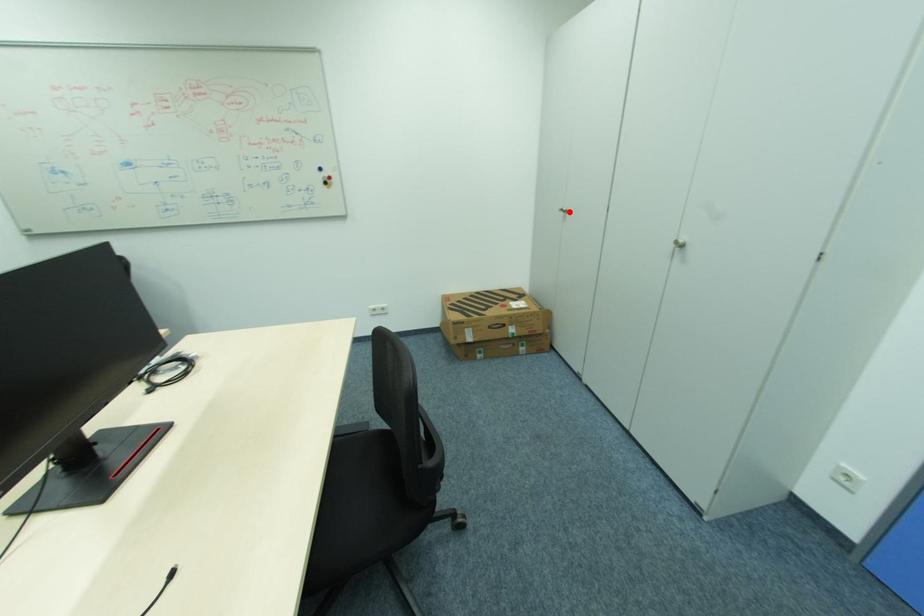
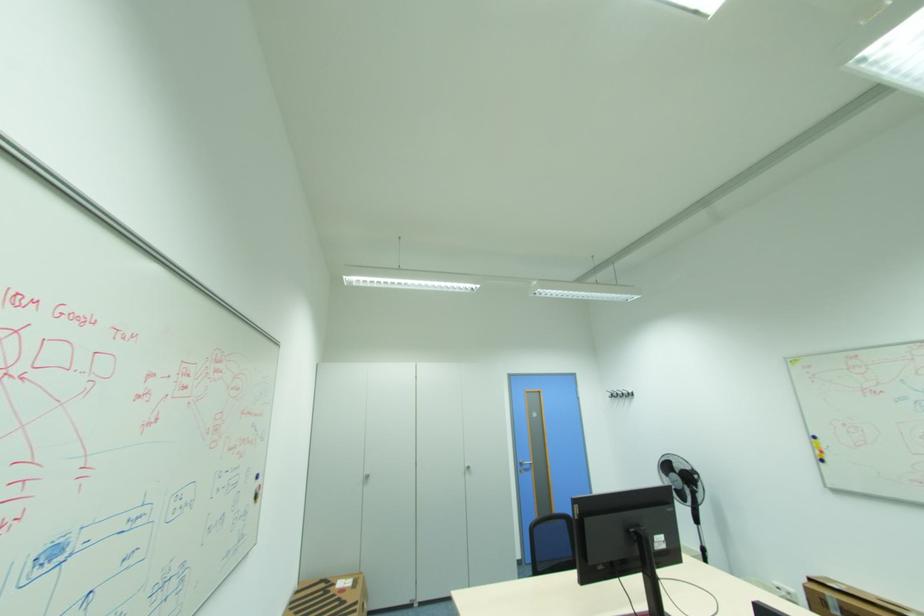
Locate, in the second image, the point that corresponds to the highlighted location in the first image.

(372, 477)